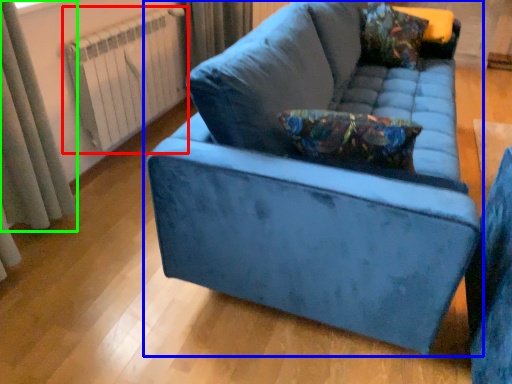
Question: Which is nearer to the radiator (highlighted by a red box)? studio couch (highlighted by a blue box) or curtain (highlighted by a green box).

Choices:
 (A) studio couch
 (B) curtain

Answer: (B)